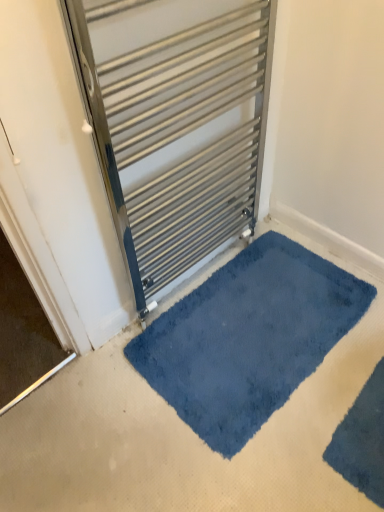
Locate an element on the screen. Image resolution: width=384 pixels, height=512 pixels. vacant area situated below blue plush bath mat at center, which ranks as the second bath mat in front-to-back order (from a real-world perspective) is located at coordinates (234, 344).